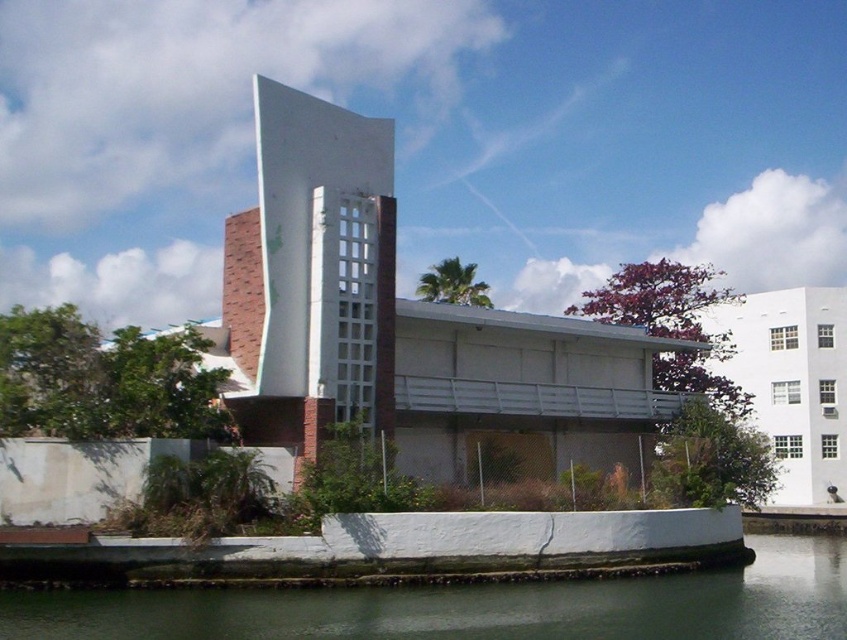
Does white glass tower at center have a greater height compared to greenish water at lower center?

Indeed, white glass tower at center has a greater height compared to greenish water at lower center.

Does point (242, 234) come in front of point (21, 600)?

No, it is behind (21, 600).

Find the location of `white glass tower at center`. white glass tower at center is located at coordinates tap(313, 273).